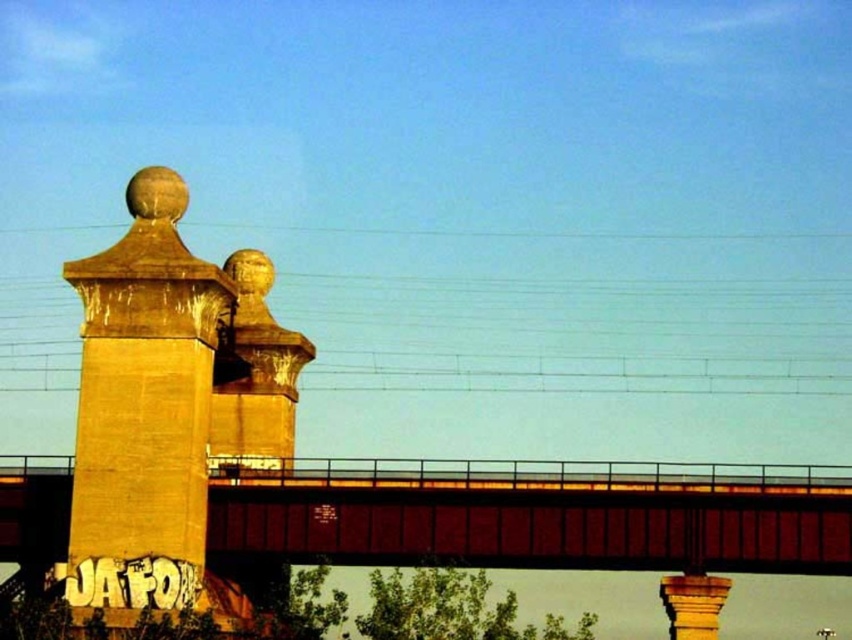
Does metallic bridge at center lie behind gold textured ball at upper center?

No, metallic bridge at center is in front of gold textured ball at upper center.

What do you see at coordinates (538, 515) in the screenshot? The image size is (852, 640). I see `metallic bridge at center` at bounding box center [538, 515].

You are a GUI agent. You are given a task and a screenshot of the screen. Output one action in this format:
    pyautogui.click(x=<x>, y=<y>)
    Task: Click on the metallic bridge at center
    This screenshot has width=852, height=640.
    Given the screenshot: What is the action you would take?
    pyautogui.click(x=538, y=515)

Who is shorter, yellowish concrete pillar at left or gold textured ball at upper center?

With less height is gold textured ball at upper center.

Does yellowish concrete pillar at left have a greater width compared to gold textured ball at upper center?

In fact, yellowish concrete pillar at left might be narrower than gold textured ball at upper center.

You are a GUI agent. You are given a task and a screenshot of the screen. Output one action in this format:
    pyautogui.click(x=<x>, y=<y>)
    Task: Click on the yellowish concrete pillar at left
    
    Given the screenshot: What is the action you would take?
    pyautogui.click(x=144, y=408)

Can you confirm if metallic bridge at center is positioned below yellowish concrete pillar at left?

Correct, metallic bridge at center is located below yellowish concrete pillar at left.

Does metallic bridge at center appear on the right side of yellowish concrete pillar at left?

Indeed, metallic bridge at center is positioned on the right side of yellowish concrete pillar at left.

Locate an element on the screen. This screenshot has width=852, height=640. metallic bridge at center is located at coordinates (538, 515).

Identify the location of metallic bridge at center. This screenshot has height=640, width=852. (538, 515).